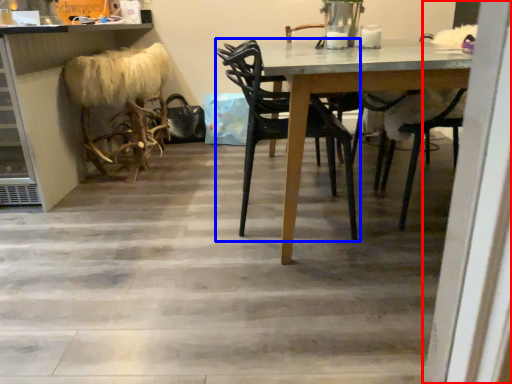
Question: Which of the following is the farthest to the observer, screen door (highlighted by a red box) or chair (highlighted by a blue box)?

Choices:
 (A) screen door
 (B) chair

Answer: (B)